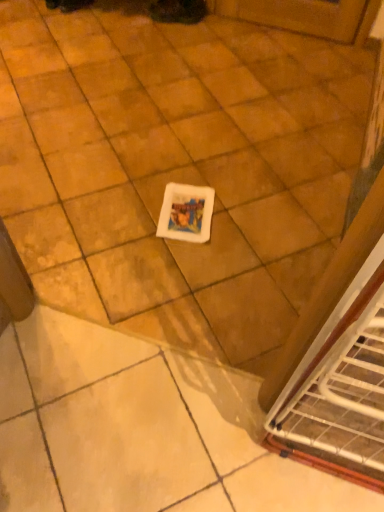
Where is `free spot to the left of matte black shoe at upper center`? The width and height of the screenshot is (384, 512). free spot to the left of matte black shoe at upper center is located at coordinates (142, 22).